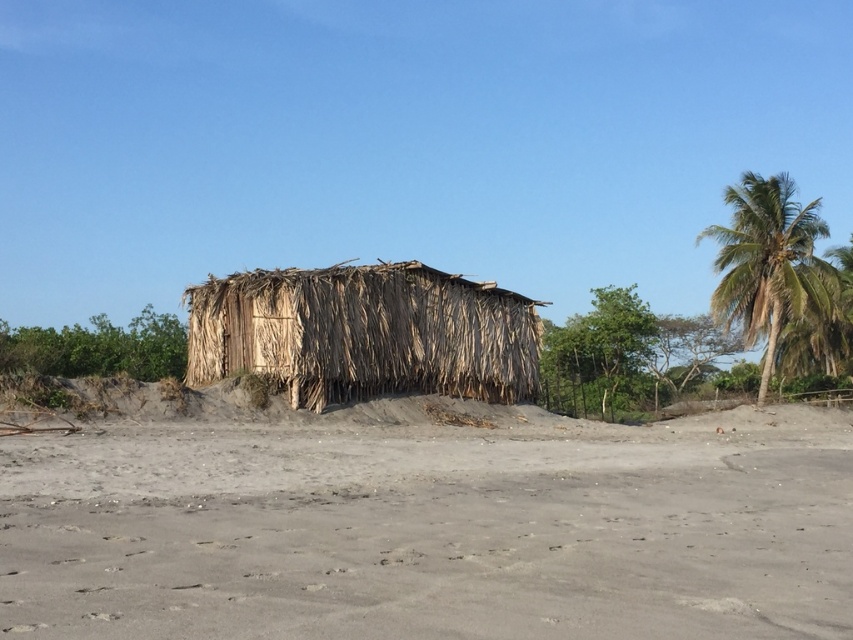
Question: Does dry grass hut at center have a lesser width compared to green leafy palm tree at upper right?

Choices:
 (A) yes
 (B) no

Answer: (A)

Question: Which point is farther to the camera?

Choices:
 (A) green leafy palm tree at upper right
 (B) dry grass hut at center
 (C) gray sandy beach at center

Answer: (A)

Question: Estimate the real-world distances between objects in this image. Which object is closer to the dry grass hut at center?

Choices:
 (A) green leafy palm tree at upper right
 (B) gray sandy beach at center

Answer: (B)

Question: Can you confirm if gray sandy beach at center is thinner than green leafy palm tree at upper right?

Choices:
 (A) yes
 (B) no

Answer: (A)

Question: Which point is farther from the camera taking this photo?

Choices:
 (A) (733, 186)
 (B) (515, 369)

Answer: (A)

Question: Considering the relative positions of gray sandy beach at center and dry grass hut at center in the image provided, where is gray sandy beach at center located with respect to dry grass hut at center?

Choices:
 (A) left
 (B) right

Answer: (B)